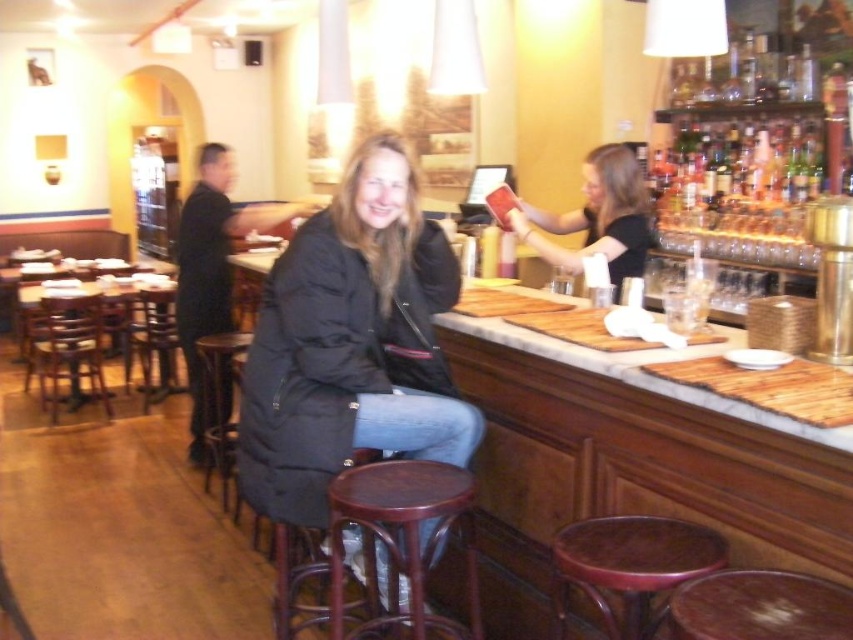
Question: Estimate the real-world distances between objects in this image. Which object is farther from the black uniform at left?

Choices:
 (A) wooden stool at lower center
 (B) mahogany wood bar stool at center

Answer: (A)

Question: Can you confirm if mahogany wood bar stool at center is wider than black uniform at left?

Choices:
 (A) yes
 (B) no

Answer: (B)

Question: Is translucent glass bottles at upper right thinner than wooden stool at lower center?

Choices:
 (A) yes
 (B) no

Answer: (B)

Question: Which of the following is the farthest from the observer?

Choices:
 (A) black uniform at left
 (B) matte black jacket at upper right
 (C) mahogany wood bar stool at center

Answer: (A)

Question: Considering the real-world distances, which object is closest to the mahogany wood bar stool at center?

Choices:
 (A) wooden stool at lower right
 (B) matte black jacket at upper right
 (C) black uniform at left

Answer: (A)

Question: Does mahogany wood bar stool at center come in front of matte black jacket at upper right?

Choices:
 (A) yes
 (B) no

Answer: (A)